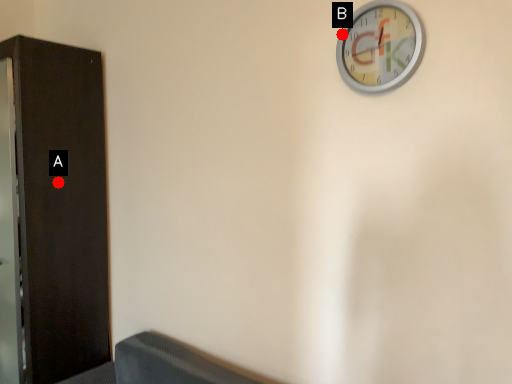
Question: Two points are circled on the image, labeled by A and B beside each circle. Which point is farther to the camera?

Choices:
 (A) A is further
 (B) B is further

Answer: (A)